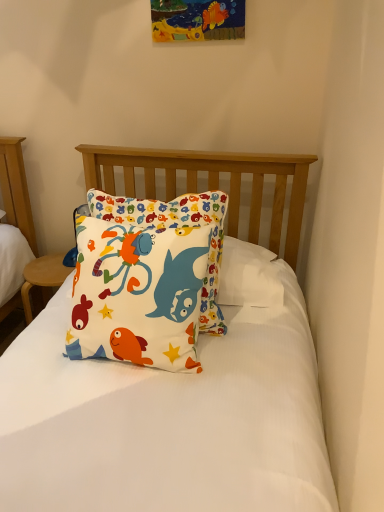
Locate an element on the screen. This screenshot has height=512, width=384. matte fabric pillow with sea creatures at center is located at coordinates (140, 290).

Describe the element at coordinates (140, 290) in the screenshot. I see `matte fabric pillow with sea creatures at center` at that location.

What are the coordinates of `matte fabric pillow with sea creatures at center` in the screenshot? It's located at (140, 290).